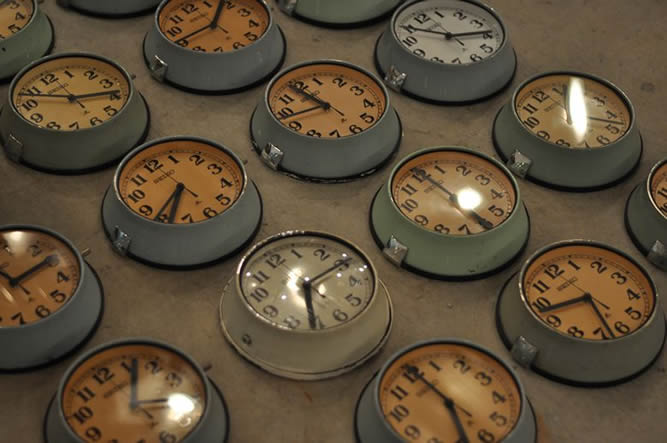
You are a GUI agent. You are given a task and a screenshot of the screen. Output one action in this format:
    pyautogui.click(x=<x>, y=<y>)
    Task: Click on the white clock
    The width and height of the screenshot is (667, 443).
    Given the screenshot: What is the action you would take?
    pyautogui.click(x=299, y=298)